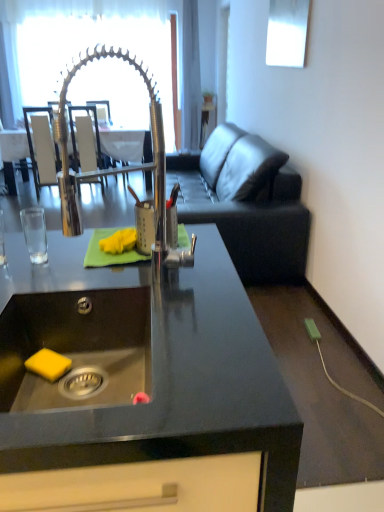
Question: Is dark gray leather couch at right facing towards white leather armchair at upper left, which is the 2th armchair in right-to-left order?

Choices:
 (A) no
 (B) yes

Answer: (B)

Question: Is dark gray leather couch at right smaller than white leather armchair at upper left, the 1th armchair viewed from the left?

Choices:
 (A) yes
 (B) no

Answer: (B)

Question: From the image's perspective, is dark gray leather couch at right above white leather armchair at upper left, the 1th armchair viewed from the left?

Choices:
 (A) no
 (B) yes

Answer: (A)

Question: Is dark gray leather couch at right further to the viewer compared to white leather armchair at upper left, the 1th armchair viewed from the left?

Choices:
 (A) no
 (B) yes

Answer: (A)

Question: Is dark gray leather couch at right positioned far away from white leather armchair at upper left, which is the 2th armchair in right-to-left order?

Choices:
 (A) no
 (B) yes

Answer: (B)

Question: In the image, is clear glass door at upper center positioned in front of or behind wooden armchair at center, acting as the 2th armchair starting from the left?

Choices:
 (A) front
 (B) behind

Answer: (B)

Question: From the image's perspective, relative to wooden armchair at center, acting as the 2th armchair starting from the left, is clear glass door at upper center above or below?

Choices:
 (A) above
 (B) below

Answer: (A)

Question: Looking at their shapes, would you say clear glass door at upper center is wider or thinner than wooden armchair at center, which appears as the 1th armchair when viewed from the right?

Choices:
 (A) thin
 (B) wide

Answer: (A)

Question: From a real-world perspective, is clear glass door at upper center above or below wooden armchair at center, acting as the 2th armchair starting from the left?

Choices:
 (A) below
 (B) above

Answer: (B)

Question: From a real-world perspective, relative to dark gray leather couch at right, is black granite countertop at center vertically above or below?

Choices:
 (A) above
 (B) below

Answer: (B)

Question: In the image, is black granite countertop at center on the left side or the right side of dark gray leather couch at right?

Choices:
 (A) left
 (B) right

Answer: (A)

Question: Considering the positions of black granite countertop at center and dark gray leather couch at right in the image, is black granite countertop at center bigger or smaller than dark gray leather couch at right?

Choices:
 (A) big
 (B) small

Answer: (B)

Question: Considering the positions of point (269, 493) and point (268, 234), is point (269, 493) closer or farther from the camera than point (268, 234)?

Choices:
 (A) farther
 (B) closer

Answer: (B)

Question: Is black granite countertop at center bigger or smaller than white leather armchair at upper left, the 1th armchair viewed from the left?

Choices:
 (A) big
 (B) small

Answer: (A)

Question: Considering the positions of black granite countertop at center and white leather armchair at upper left, the 1th armchair viewed from the left, in the image, is black granite countertop at center wider or thinner than white leather armchair at upper left, the 1th armchair viewed from the left,?

Choices:
 (A) thin
 (B) wide

Answer: (B)